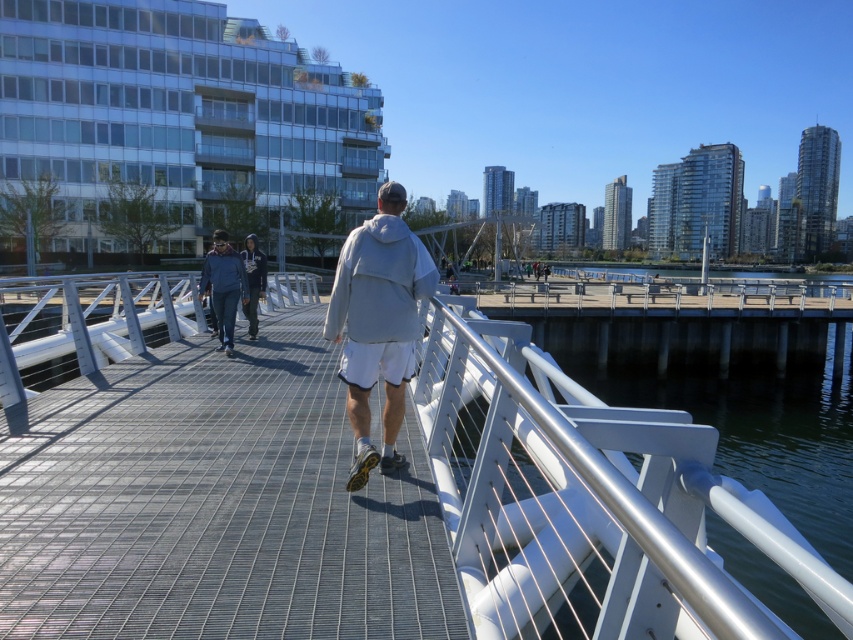
Question: Is white cotton hoodie at center smaller than blue fleece jacket at center?

Choices:
 (A) no
 (B) yes

Answer: (B)

Question: Which object is the closest to the light gray hoodie at center?

Choices:
 (A) dark blue hoodie at center
 (B) metal grid walkway at center

Answer: (B)

Question: Which of the following is the closest to the observer?

Choices:
 (A) light gray hoodie at center
 (B) white cotton hoodie at center

Answer: (A)

Question: Is the position of blue fleece jacket at center more distant than that of dark blue hoodie at center?

Choices:
 (A) yes
 (B) no

Answer: (B)

Question: Does metal grid walkway at center appear on the right side of dark blue hoodie at center?

Choices:
 (A) no
 (B) yes

Answer: (B)

Question: Among these points, which one is farthest from the camera?

Choices:
 (A) (368, 412)
 (B) (225, 353)
 (C) (370, 499)
 (D) (421, 296)

Answer: (B)